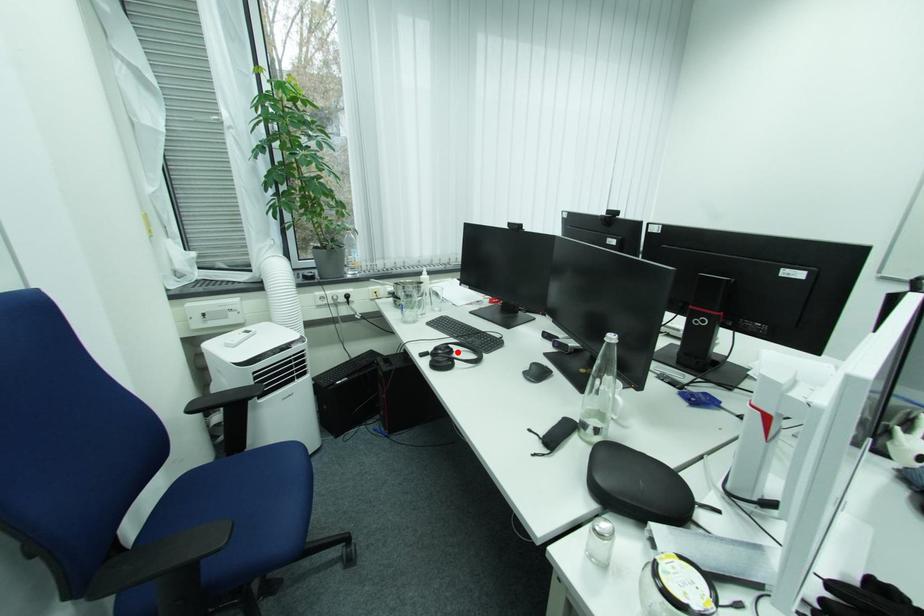
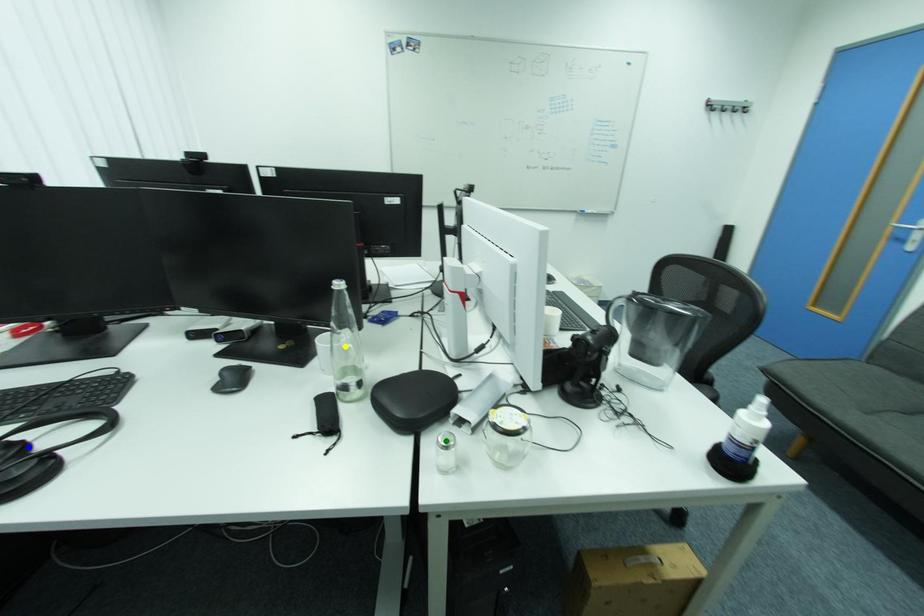
Question: I am providing you with two images of the same scene from different viewpoints. A red point is marked on the first image. You are given multiple points on the second image. Which point in image 2 is actually the same real-world point as the red point in image 1?

Choices:
 (A) green point
 (B) blue point
 (C) yellow point

Answer: (B)